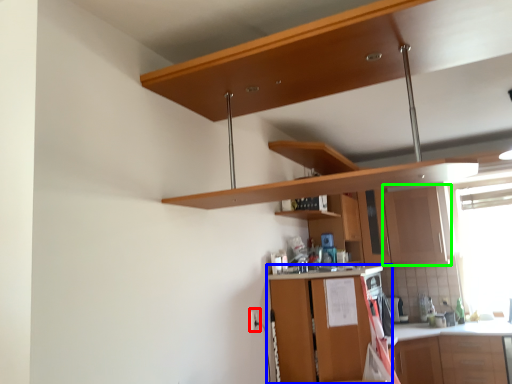
Question: Considering the real-world distances, which object is farthest from electric outlet (highlighted by a red box)? cabinetry (highlighted by a blue box) or cabinetry (highlighted by a green box)?

Choices:
 (A) cabinetry
 (B) cabinetry

Answer: (B)